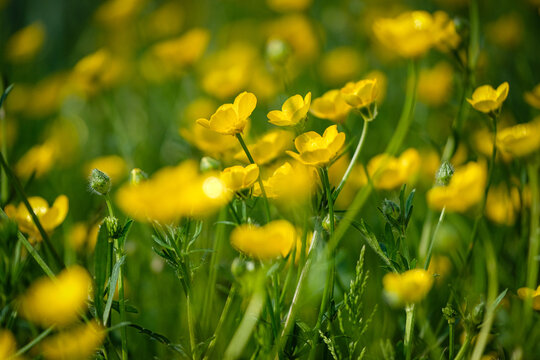
The image size is (540, 360). I want to click on bottom-left-most flower, so click(x=6, y=349).